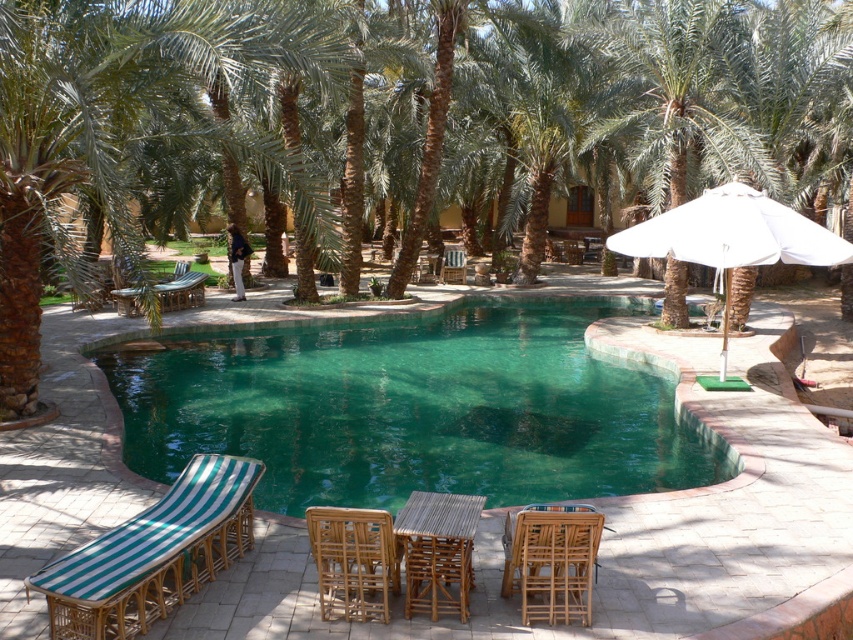
You are standing at the center of the pool and want to reach the green striped rattan daybed at lower left. Which direction should you swim to get there?

The green striped rattan daybed at lower left is located at point 0.866 on the x axis and 0.181 on the y axis. Since the daybed is at a lower left position, you should swim towards the lower left direction to reach it.

You are planning to place a large potted plant between the bamboo chair at lower center and the rattan chair at center. Which chair should the plant be closer to if you want it to be equidistant from both chairs?

The bamboo chair at lower center is smaller than the rattan chair at center, so to place the plant equidistant from both, it should be closer to the bamboo chair at lower center.